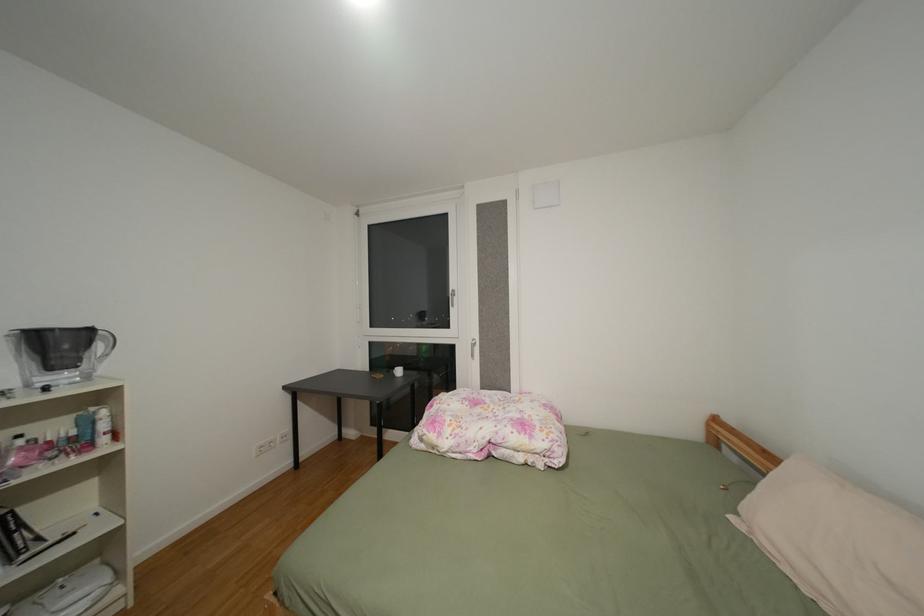
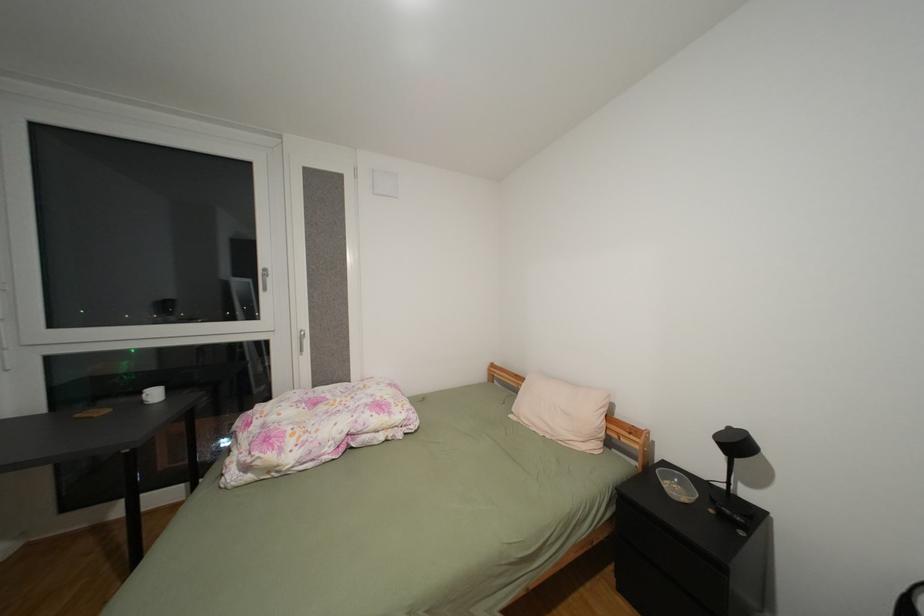
Question: The camera is either moving clockwise (left) or counter-clockwise (right) around the object. The first image is from the beginning of the video and the second image is from the end. Is the camera moving left or right when shooting the video?

Choices:
 (A) Left
 (B) Right

Answer: (A)